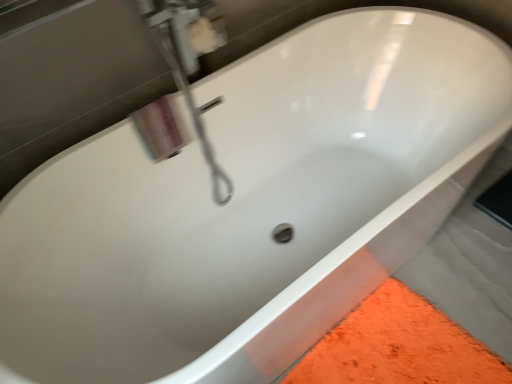
Question: From the image's perspective, is polished chrome faucet at upper left, marked as the second plumbing fixture in a back-to-front arrangement, located above or below white glossy soap dispenser at upper left, placed as the first plumbing fixture when sorted from back to front?

Choices:
 (A) above
 (B) below

Answer: (B)

Question: Is point (181, 19) positioned closer to the camera than point (177, 3)?

Choices:
 (A) closer
 (B) farther

Answer: (B)

Question: Considering the positions of polished chrome faucet at upper left, marked as the second plumbing fixture in a back-to-front arrangement, and white glossy soap dispenser at upper left, placed as the first plumbing fixture when sorted from back to front, in the image, is polished chrome faucet at upper left, marked as the second plumbing fixture in a back-to-front arrangement, wider or thinner than white glossy soap dispenser at upper left, placed as the first plumbing fixture when sorted from back to front,?

Choices:
 (A) wide
 (B) thin

Answer: (A)

Question: In the image, is white glossy soap dispenser at upper left, placed as the first plumbing fixture when sorted from back to front, positioned in front of or behind polished chrome faucet at upper left, marked as the second plumbing fixture in a back-to-front arrangement?

Choices:
 (A) behind
 (B) front

Answer: (A)

Question: Is white glossy soap dispenser at upper left, the second plumbing fixture when ordered from front to back, spatially inside polished chrome faucet at upper left, marked as the second plumbing fixture in a back-to-front arrangement, or outside of it?

Choices:
 (A) inside
 (B) outside

Answer: (B)

Question: From the image's perspective, is white glossy soap dispenser at upper left, placed as the first plumbing fixture when sorted from back to front, positioned above or below polished chrome faucet at upper left, the 1th plumbing fixture from the front?

Choices:
 (A) above
 (B) below

Answer: (A)

Question: In the image, is white glossy soap dispenser at upper left, placed as the first plumbing fixture when sorted from back to front, on the left side or the right side of polished chrome faucet at upper left, marked as the second plumbing fixture in a back-to-front arrangement?

Choices:
 (A) left
 (B) right

Answer: (B)